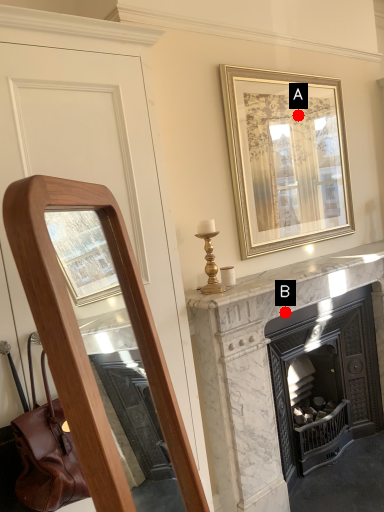
Question: Two points are circled on the image, labeled by A and B beside each circle. Which point is farther from the camera taking this photo?

Choices:
 (A) A is further
 (B) B is further

Answer: (A)